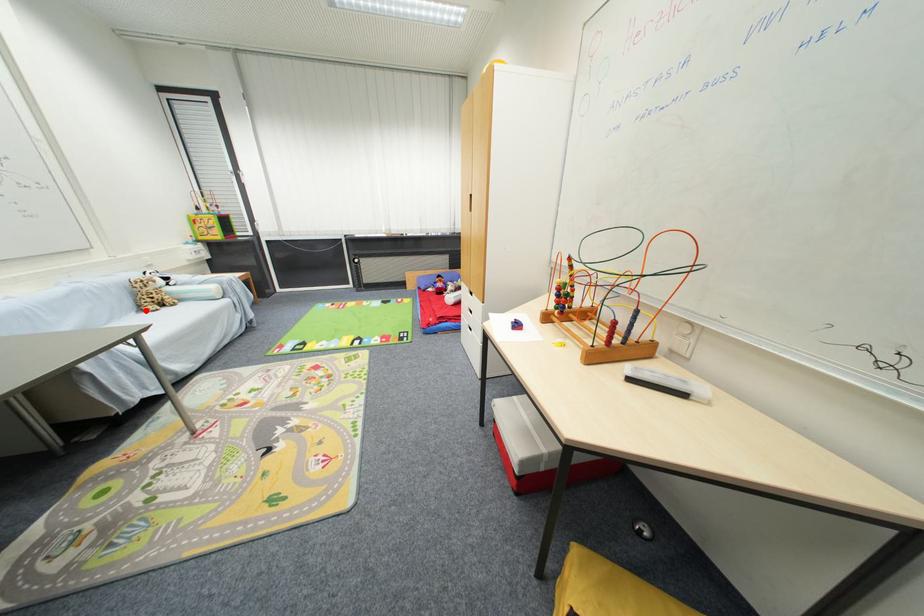
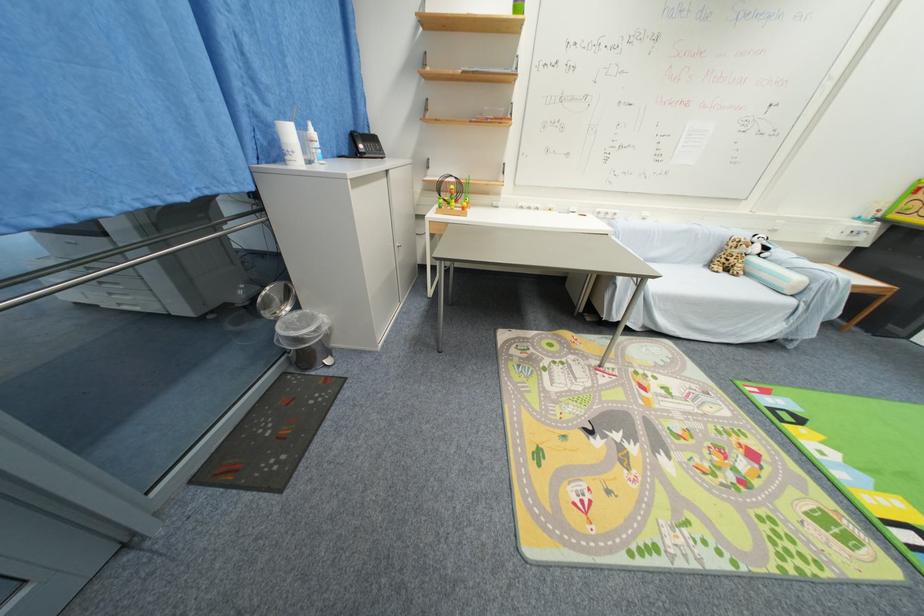
Locate, in the second image, the point that corresponds to the highlighted location in the first image.

(714, 265)